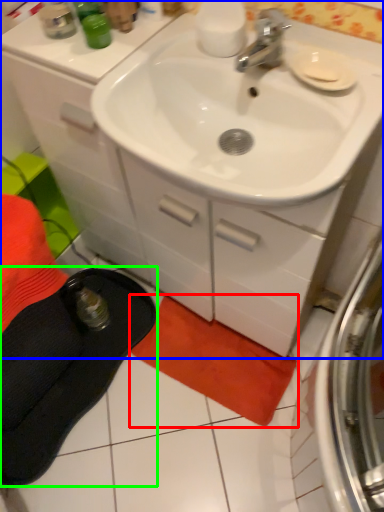
Question: Considering the real-world distances, which object is farthest from beach towel (highlighted by a red box)? bathroom cabinet (highlighted by a blue box) or slipper (highlighted by a green box)?

Choices:
 (A) bathroom cabinet
 (B) slipper

Answer: (A)